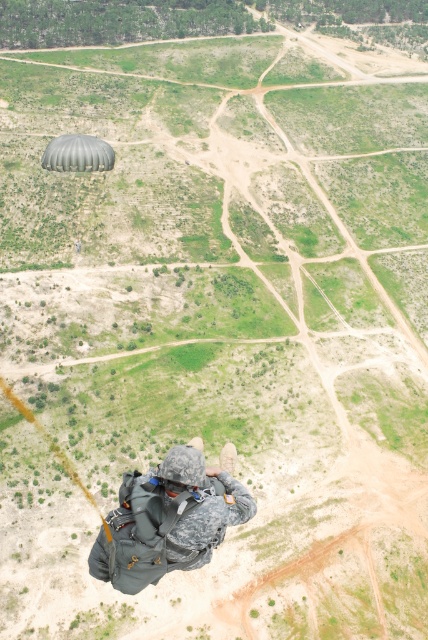
Looking at this image, who is more distant from viewer, (172,513) or (50,161)?

The point (50,161) is behind.

Describe the element at coordinates (169, 518) in the screenshot. I see `camouflage fabric helmet at center` at that location.

I want to click on camouflage fabric helmet at center, so click(x=169, y=518).